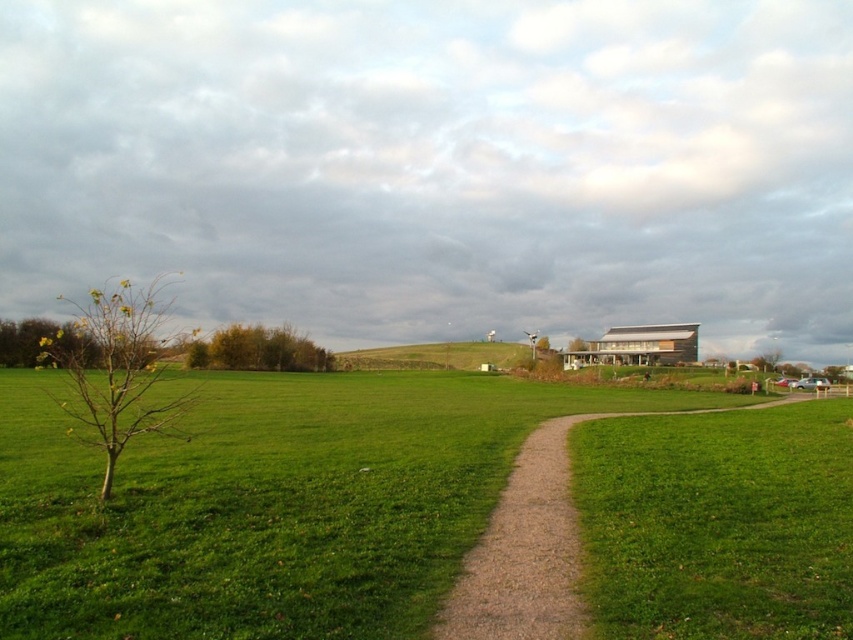
Question: Where is yellow-green leaves at left located in relation to green grassy hill at center in the image?

Choices:
 (A) below
 (B) above

Answer: (B)

Question: Which of these objects is positioned closest to the yellow-green leaves at left?

Choices:
 (A) green leafy tree at center
 (B) green grassy at lower left

Answer: (B)

Question: Is green grassy at lower left further to camera compared to yellow-green leaves at left?

Choices:
 (A) yes
 (B) no

Answer: (B)

Question: Considering the real-world distances, which object is farthest from the yellow-green leaves at left?

Choices:
 (A) green leafy tree at center
 (B) green grassy at lower left

Answer: (A)

Question: Which of these objects is positioned closest to the green grassy hill at center?

Choices:
 (A) yellow-green leaves at left
 (B) brown gravel path at center
 (C) green leafy tree at center
 (D) green grassy at lower left

Answer: (C)

Question: Does green grassy at lower left appear under green grassy hill at center?

Choices:
 (A) no
 (B) yes

Answer: (B)